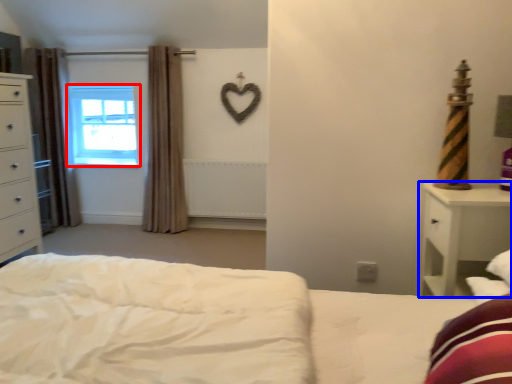
Question: Among these objects, which one is farthest to the camera, window (highlighted by a red box) or nightstand (highlighted by a blue box)?

Choices:
 (A) window
 (B) nightstand

Answer: (A)